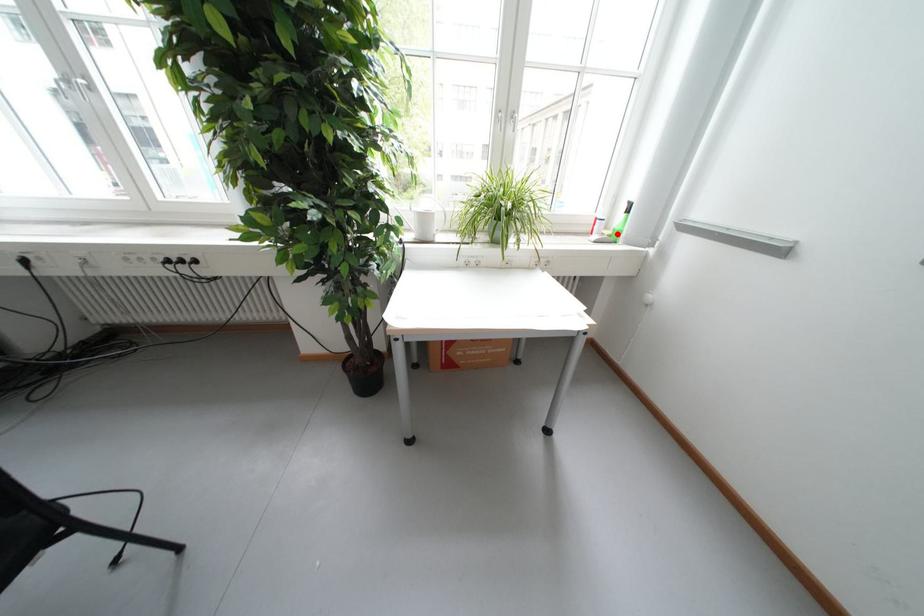
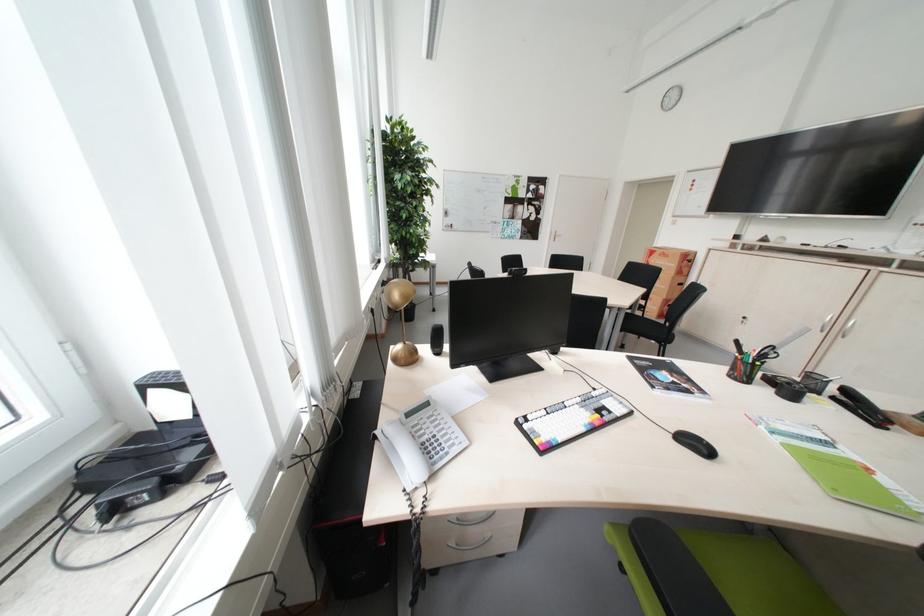
Question: I am providing you with two images of the same scene from different viewpoints. A red point is marked on the first image. Is the red point's position out of view in image 2?

Choices:
 (A) Yes
 (B) No

Answer: (A)